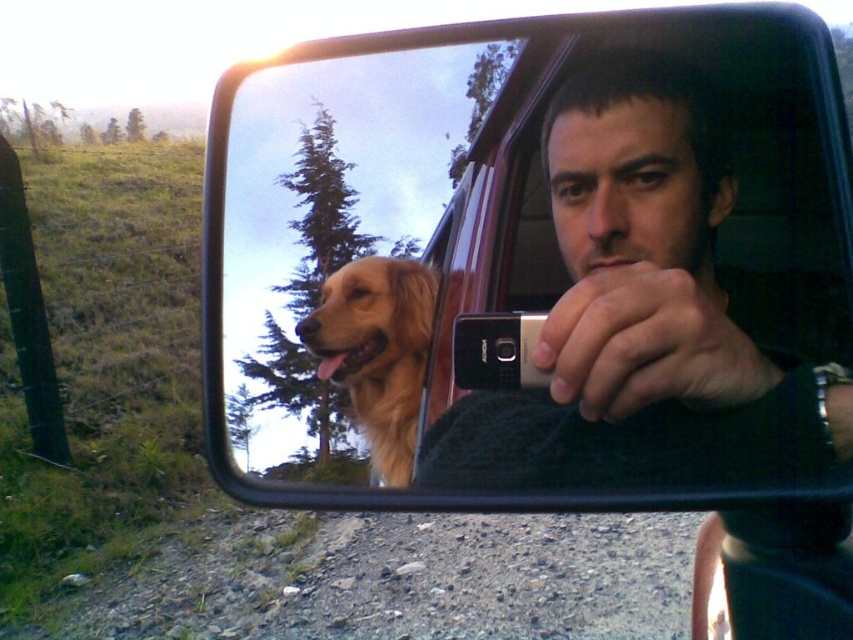
Which of these two, matte black phone at center or golden fur dog at center, stands shorter?

Standing shorter between the two is golden fur dog at center.

Who is lower down, matte black phone at center or golden fur dog at center?

golden fur dog at center

Which is behind, point (503, 458) or point (329, 346)?

The point (329, 346) is more distant.

Locate an element on the screen. This screenshot has height=640, width=853. matte black phone at center is located at coordinates (654, 316).

Is matte black phone at center to the left of golden fur dog at upper left from the viewer's perspective?

Incorrect, matte black phone at center is not on the left side of golden fur dog at upper left.

Does matte black phone at center appear under golden fur dog at upper left?

Yes.

What do you see at coordinates (654, 316) in the screenshot?
I see `matte black phone at center` at bounding box center [654, 316].

The height and width of the screenshot is (640, 853). I want to click on matte black phone at center, so click(654, 316).

Between golden fur dog at upper left and golden fur dog at center, which one appears on the left side from the viewer's perspective?

Positioned to the left is golden fur dog at upper left.

Is golden fur dog at upper left positioned at the back of golden fur dog at center?

No, golden fur dog at upper left is in front of golden fur dog at center.

Where is `golden fur dog at upper left`? The width and height of the screenshot is (853, 640). golden fur dog at upper left is located at coordinates pos(343,252).

You are a GUI agent. You are given a task and a screenshot of the screen. Output one action in this format:
    pyautogui.click(x=<x>, y=<y>)
    Task: Click on the golden fur dog at upper left
    This screenshot has width=853, height=640.
    Given the screenshot: What is the action you would take?
    pyautogui.click(x=343, y=252)